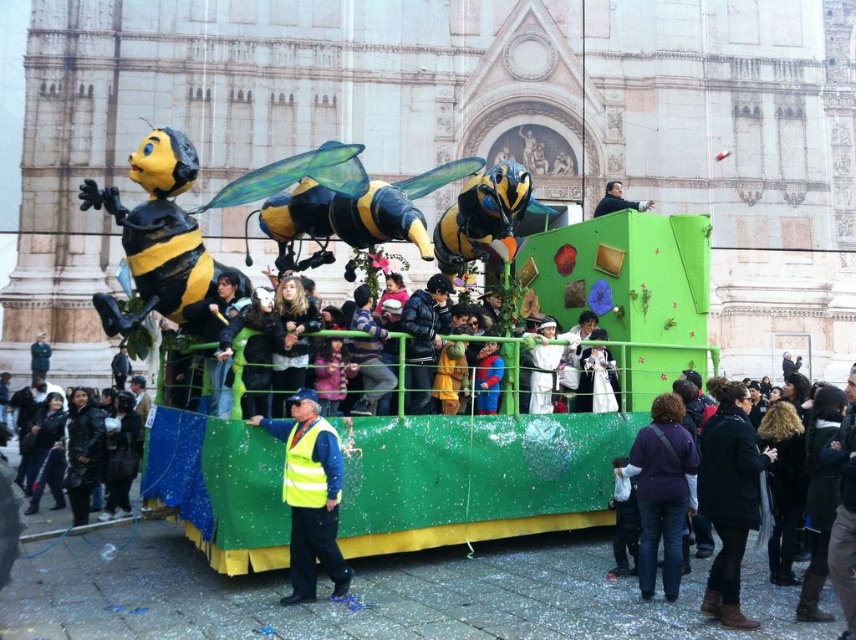
You are a photographer standing at the edge of the parade float. You notice two items at the lower right corner of your viewfinder. One is dark brown leather boots at lower right and the other is black wool coat at lower right. Which item is positioned higher in the frame?

The dark brown leather boots at lower right is above the black wool coat at lower right, so it is positioned higher in the frame.